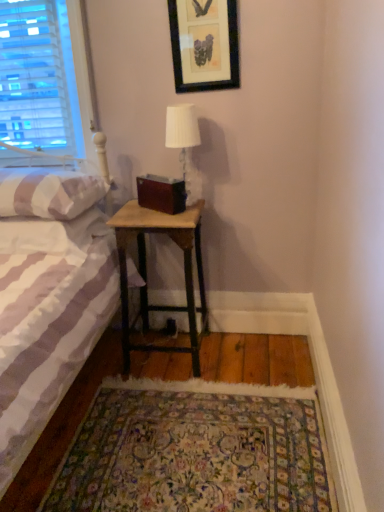
Locate an element on the screen. The height and width of the screenshot is (512, 384). empty space that is to the right of woodenmaterial/texturenightstand at lower center is located at coordinates (252, 362).